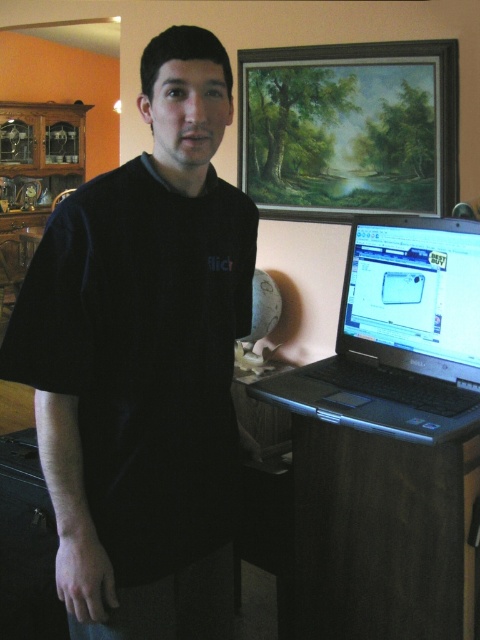
You are standing in the home office scene described. You want to place a small plant on the dark wood table at lower right. Where exactly should you place it so that it sits at the coordinates given by the point (361, 532)?

The point (361, 532) corresponds to the dark wood table at lower right, so placing the plant there would position it exactly at those coordinates on the table.

You are a photographer taking a picture of the scene. You notice two points in the image at coordinates point (111,397) and point (377,396). Which point is closer to your camera?

Point (111,397) is closer to the camera than point (377,396).

You are organizing a virtual tour of this room and need to describe the arrangement of the wooden oil painting at upper center and the black plastic laptop at right. Based on the scene, which object is positioned higher up?

The wooden oil painting at upper center is located above the black plastic laptop at right, so it is positioned higher up.